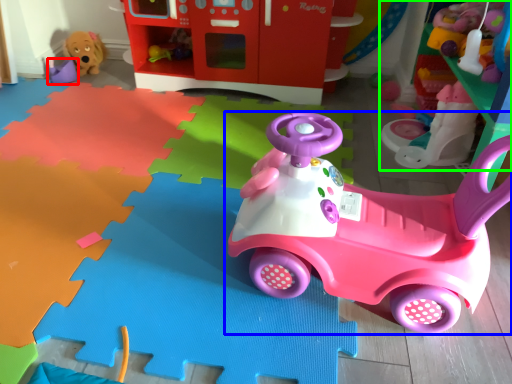
Question: Considering the real-world distances, which object is farthest from toy (highlighted by a red box)? toy (highlighted by a blue box) or toy (highlighted by a green box)?

Choices:
 (A) toy
 (B) toy

Answer: (A)